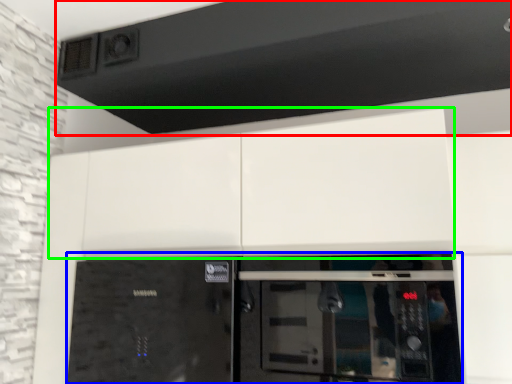
Question: Which is nearer to the exhaust hood (highlighted by a red box)? home appliance (highlighted by a blue box) or cabinetry (highlighted by a green box).

Choices:
 (A) home appliance
 (B) cabinetry

Answer: (B)